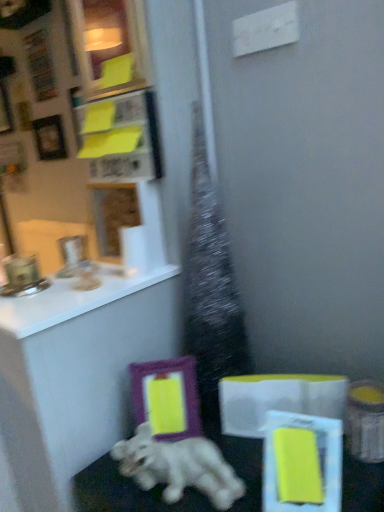
Locate an element on the screen. The height and width of the screenshot is (512, 384). free region under white glossy dog at lower center (from a real-world perspective) is located at coordinates (193, 497).